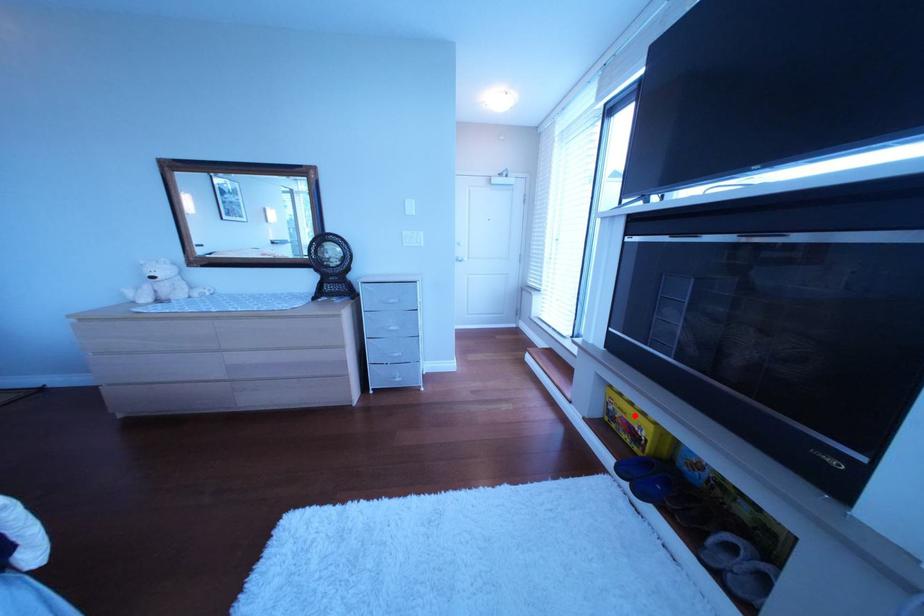
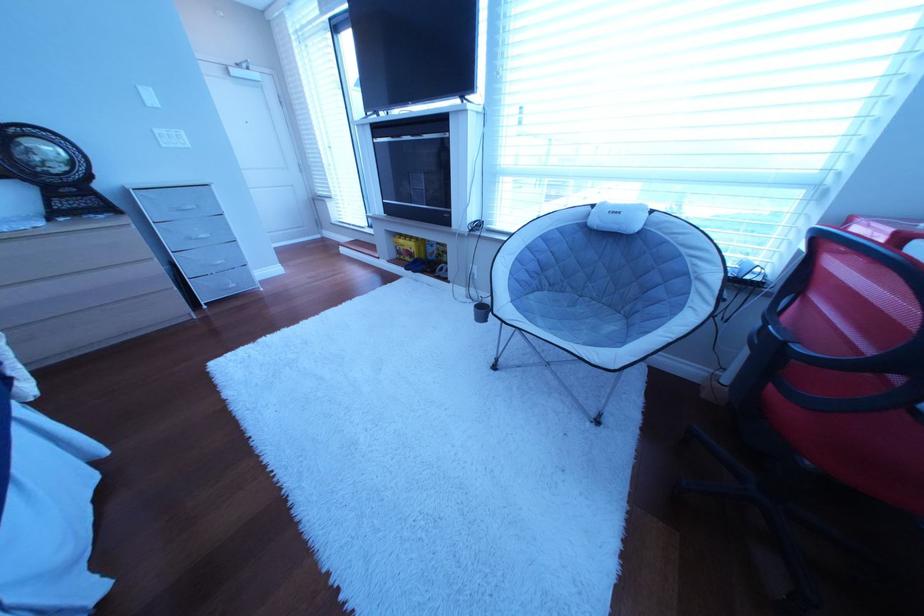
Question: I am providing you with two images of the same scene from different viewpoints. Image1 has a red point marked. In image2, the corresponding 3D location appears at what relative position? Reply with the corresponding letter.

Choices:
 (A) Closer
 (B) Farther

Answer: (A)